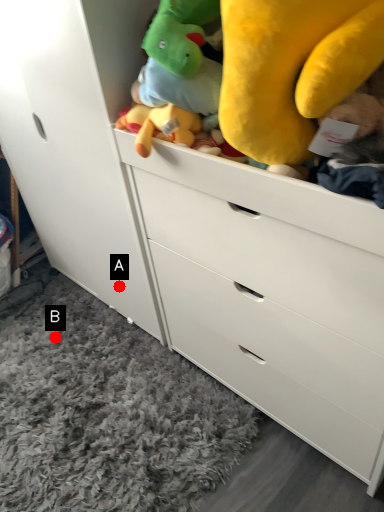
Question: Two points are circled on the image, labeled by A and B beside each circle. Among these points, which one is farthest from the camera?

Choices:
 (A) A is further
 (B) B is further

Answer: (B)